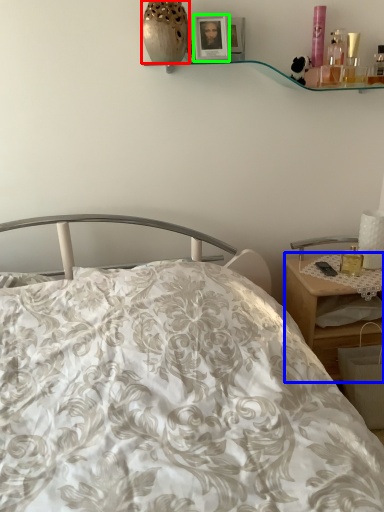
Question: Which is farther away from vase (highlighted by a red box)? desk (highlighted by a blue box) or picture frame (highlighted by a green box)?

Choices:
 (A) desk
 (B) picture frame

Answer: (A)